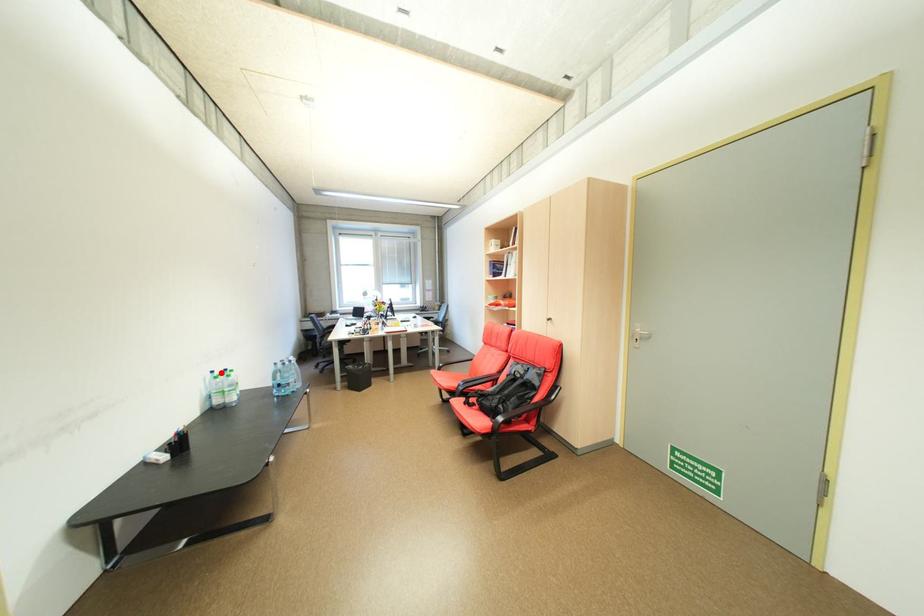
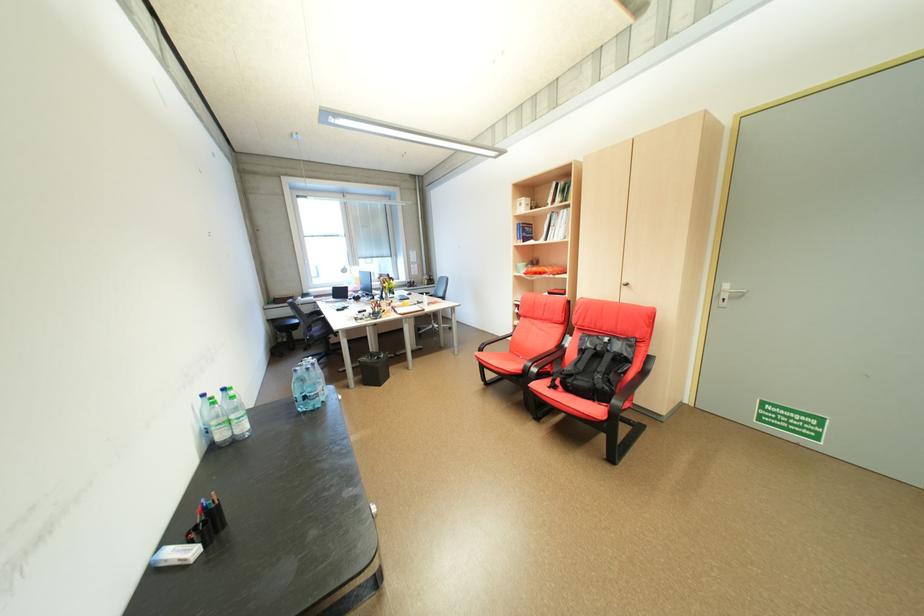
Find the pixel in the second image that matches the highlighted location in the first image.

(213, 395)